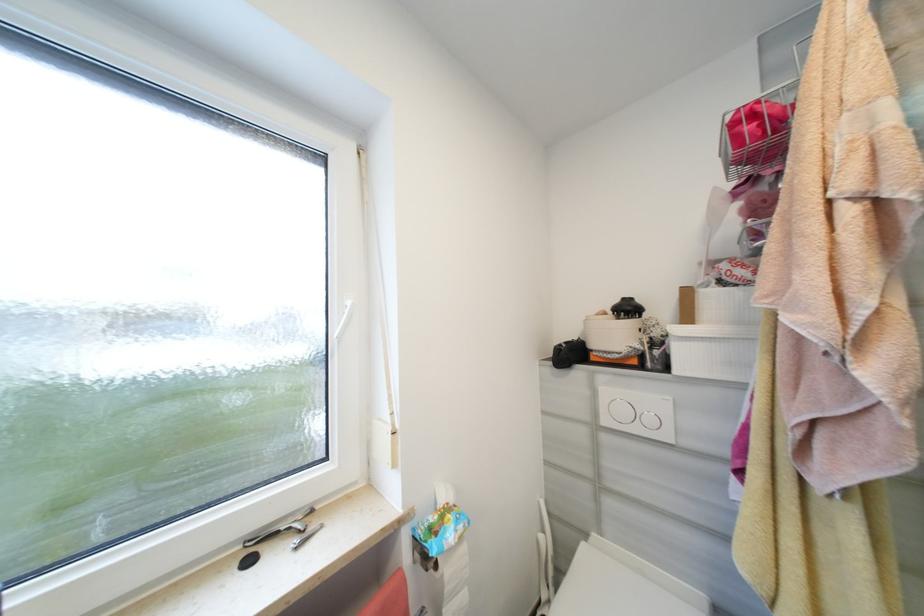
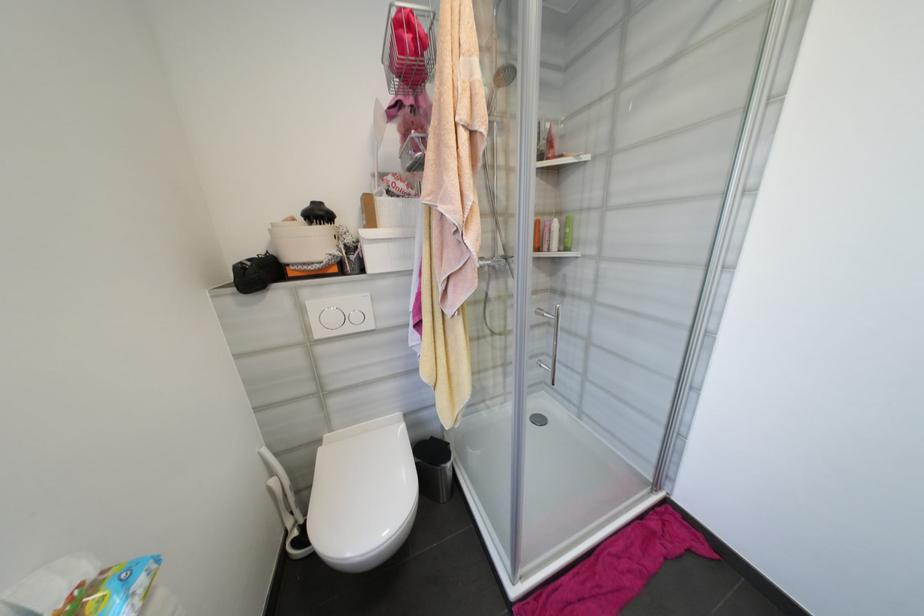
In the second image, find the point that corresponds to (592,318) in the first image.

(280, 225)